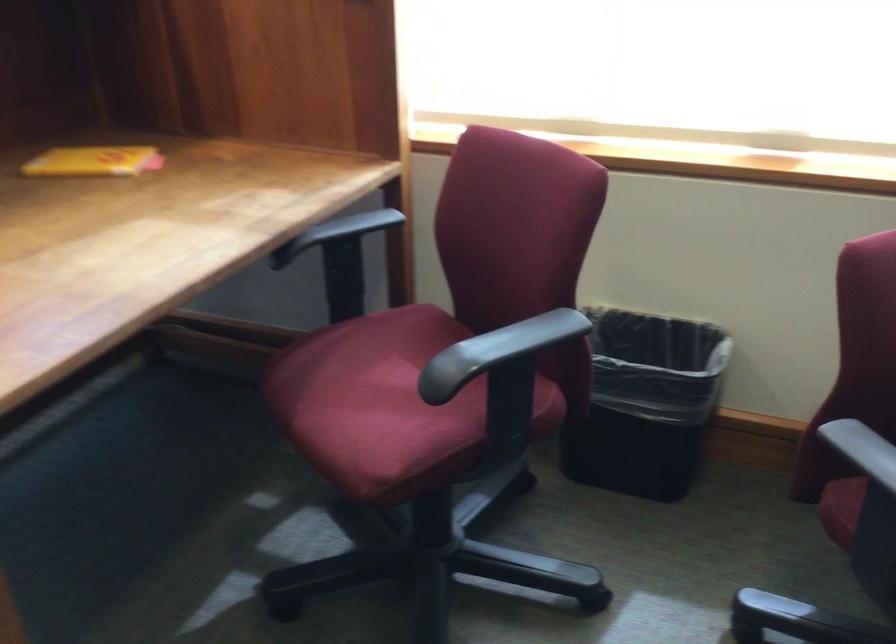
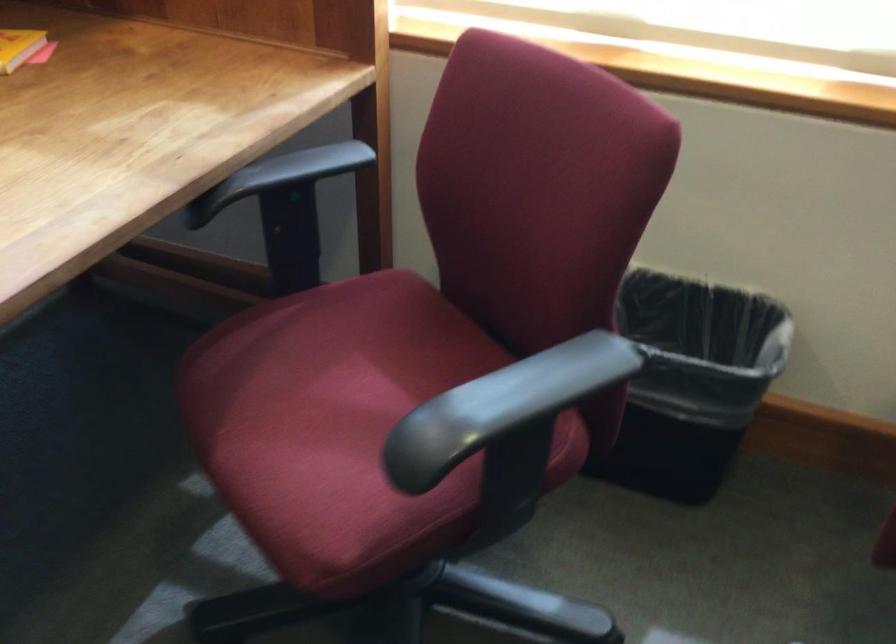
Question: The images are taken continuously from a first-person perspective. In which direction is your viewpoint rotating?

Choices:
 (A) Left
 (B) Right
 (C) Up
 (D) Down

Answer: (D)